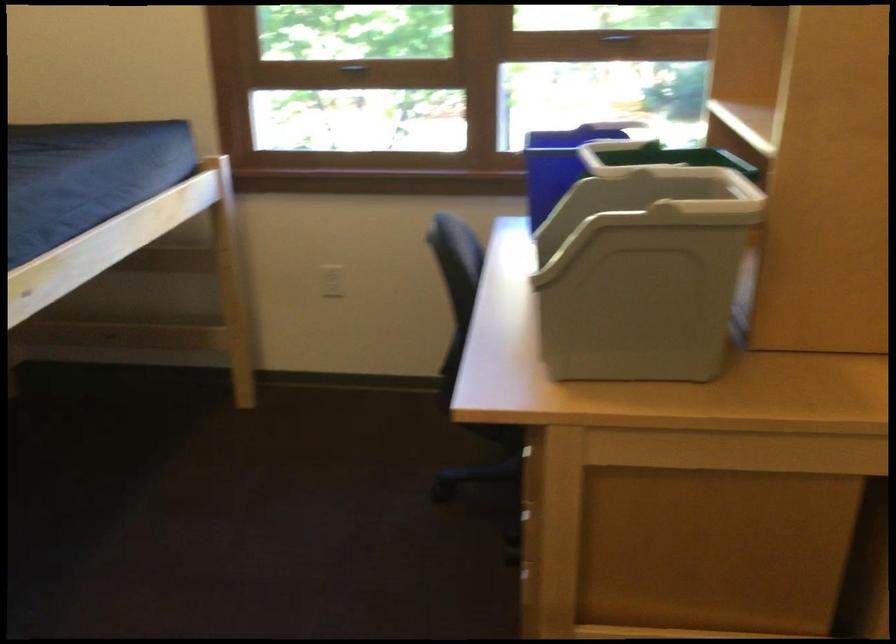
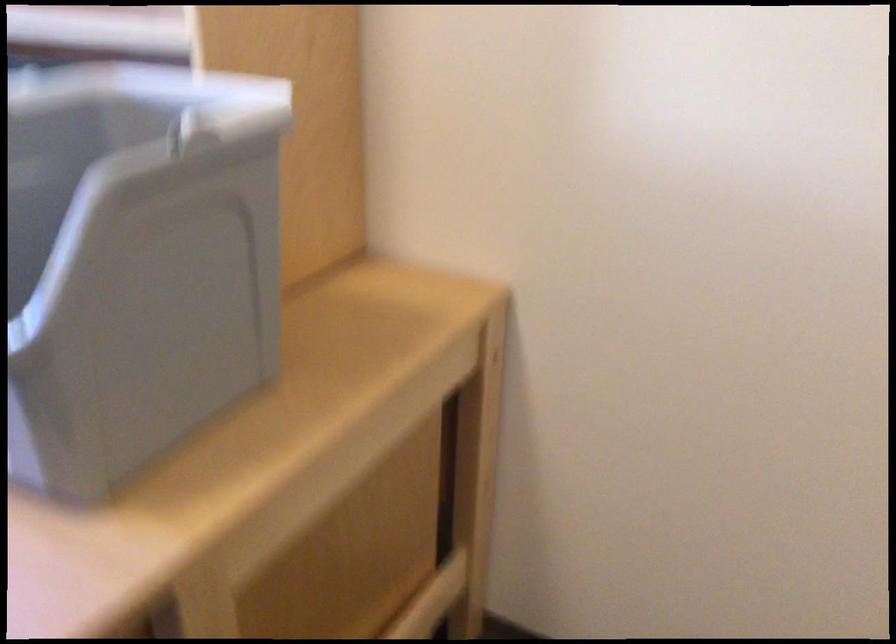
Find the pixel in the second image that matches point (612, 267) in the first image.

(135, 263)